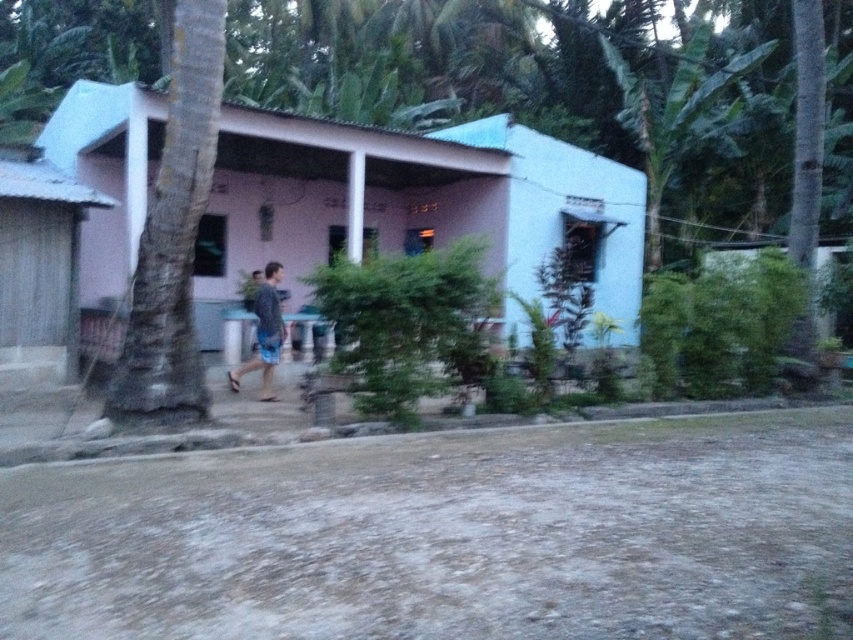
Question: Which of the following is the farthest from the observer?

Choices:
 (A) (276, 264)
 (B) (601, 202)

Answer: (B)

Question: Can you confirm if pink matte house at center is positioned below blue denim shorts at center?

Choices:
 (A) yes
 (B) no

Answer: (B)

Question: Among these points, which one is farthest from the camera?

Choices:
 (A) (97, 93)
 (B) (260, 323)

Answer: (A)

Question: Among these points, which one is nearest to the camera?

Choices:
 (A) (519, 340)
 (B) (260, 310)

Answer: (B)

Question: Is pink matte house at center smaller than blue denim shorts at center?

Choices:
 (A) yes
 (B) no

Answer: (B)

Question: Can you confirm if pink matte house at center is positioned to the left of blue denim shorts at center?

Choices:
 (A) yes
 (B) no

Answer: (B)